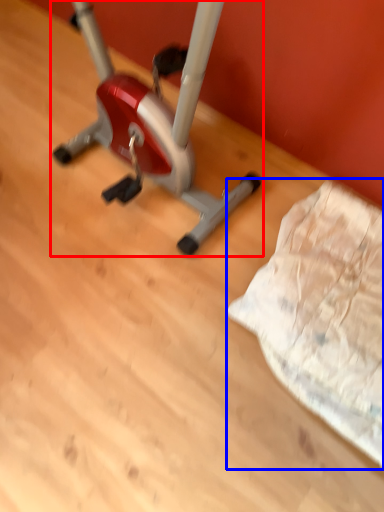
Question: Among these objects, which one is farthest to the camera, stationary bicycle (highlighted by a red box) or sheet (highlighted by a blue box)?

Choices:
 (A) stationary bicycle
 (B) sheet

Answer: (B)